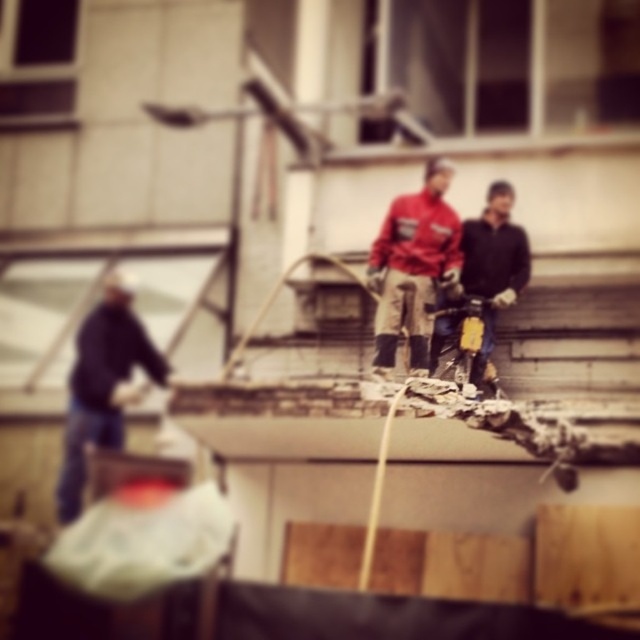
Does red matte jacket at center appear on the right side of dark blue jeans at left?

Yes, red matte jacket at center is to the right of dark blue jeans at left.

Can you confirm if red matte jacket at center is thinner than dark blue jeans at left?

Indeed, red matte jacket at center has a lesser width compared to dark blue jeans at left.

Is point (394, 317) farther from viewer compared to point (136, 392)?

No, (394, 317) is in front of (136, 392).

I want to click on red matte jacket at center, so click(x=413, y=268).